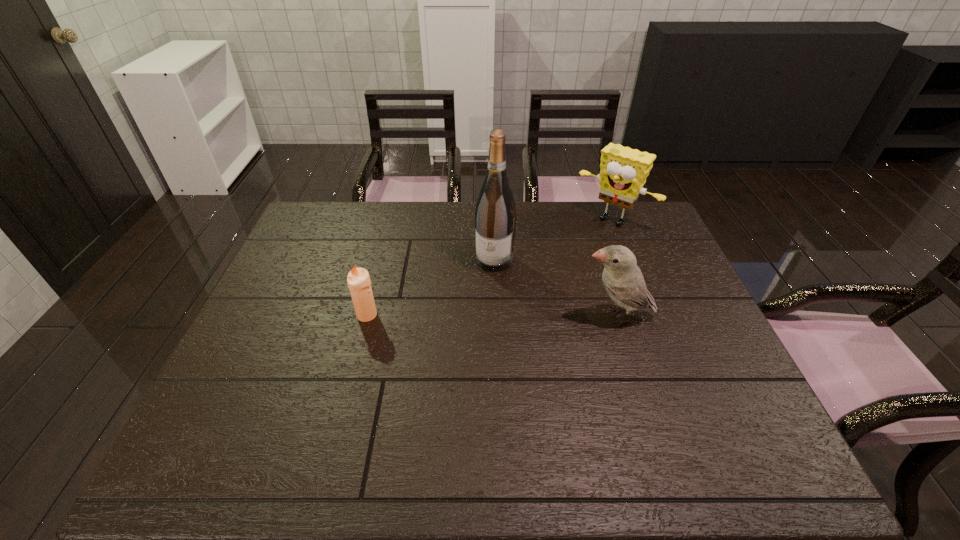
I want to click on vacant spot on the desktop that is between the candle and the bird and is positioned on the front-facing side of the farthest object, so click(x=527, y=316).

Identify the location of vacant space on the desktop that is between the candle and the bird and is positioned on the label of the third object from right to left. (476, 315).